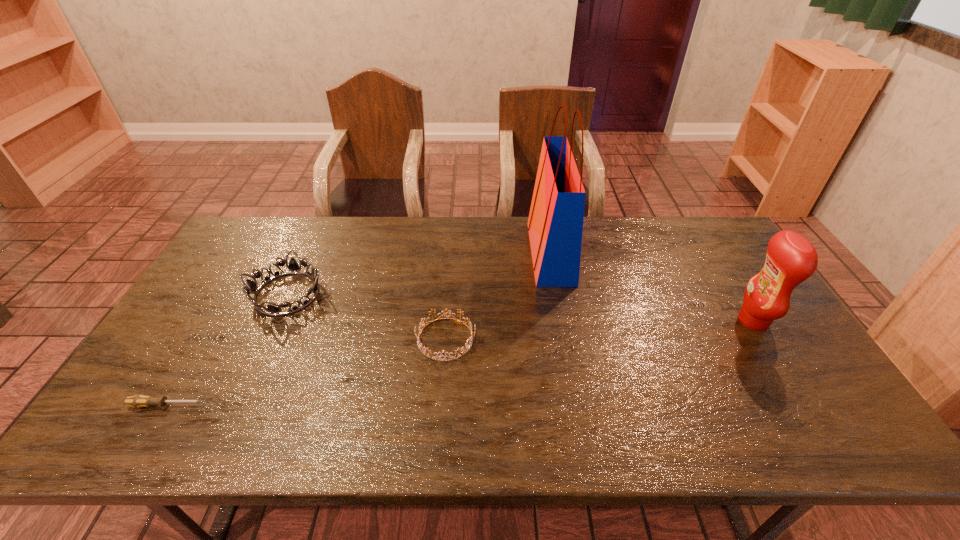
Identify the location of free location that satisfies the following two spatial constraints: 1. on the front-facing side of the taller tiara; 2. at the tip of the screwdriver. This screenshot has width=960, height=540. (235, 405).

Where is `vacant space that satisfies the following two spatial constraints: 1. on the front-facing side of the left tiara; 2. at the tip of the nearest object`? Image resolution: width=960 pixels, height=540 pixels. vacant space that satisfies the following two spatial constraints: 1. on the front-facing side of the left tiara; 2. at the tip of the nearest object is located at coordinates (235, 405).